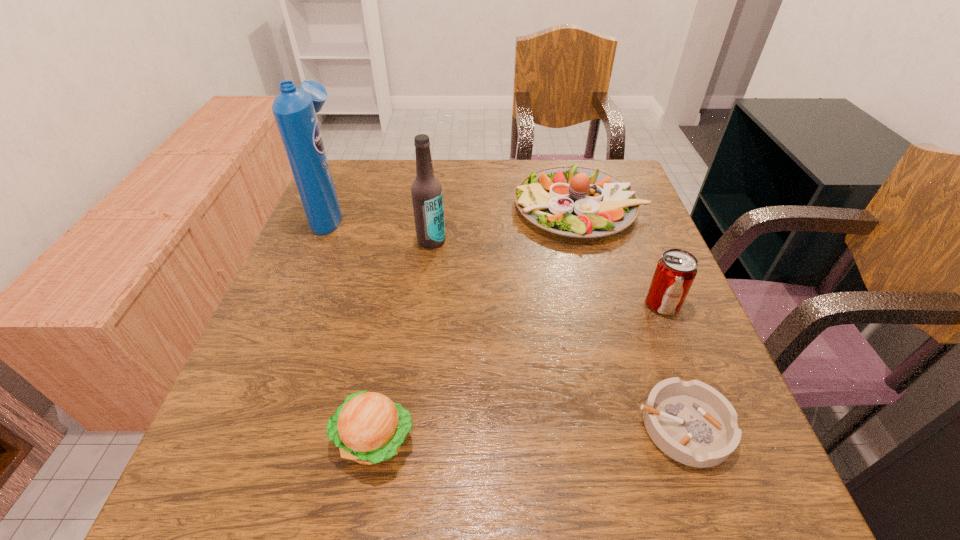
This screenshot has height=540, width=960. I want to click on shampoo, so [x=294, y=109].

What are the coordinates of `the leftmost object` in the screenshot? It's located at (294, 109).

The height and width of the screenshot is (540, 960). What are the coordinates of `the fifth shortest object` in the screenshot? It's located at (426, 190).

At what (x,y) coordinates should I click in order to perform the action: click on the fourth farthest object. Please return your answer as a coordinate pair (x, y). The width and height of the screenshot is (960, 540). Looking at the image, I should click on (675, 271).

Where is `pop soda`? The image size is (960, 540). pop soda is located at coordinates (675, 271).

At what (x,y) coordinates should I click in order to perform the action: click on salad plate. Please return your answer as a coordinate pair (x, y). This screenshot has width=960, height=540. Looking at the image, I should click on (573, 201).

Where is `hamburger`? hamburger is located at coordinates (369, 428).

You are a GUI agent. You are given a task and a screenshot of the screen. Output one action in this format:
    pyautogui.click(x=<x>, y=<y>)
    Task: Click on the shortest object
    Image resolution: width=960 pixels, height=540 pixels.
    Given the screenshot: What is the action you would take?
    pyautogui.click(x=691, y=422)

What are the coordinates of `vacant space located on the right of the leftmost object` in the screenshot? It's located at (372, 212).

You are a GUI agent. You are given a task and a screenshot of the screen. Output one action in this format:
    pyautogui.click(x=<x>, y=<y>)
    Task: Click on the vacant space situated 0.270m on the side of the fifth shortest object with the label
    The height and width of the screenshot is (540, 960).
    Given the screenshot: What is the action you would take?
    pyautogui.click(x=419, y=341)